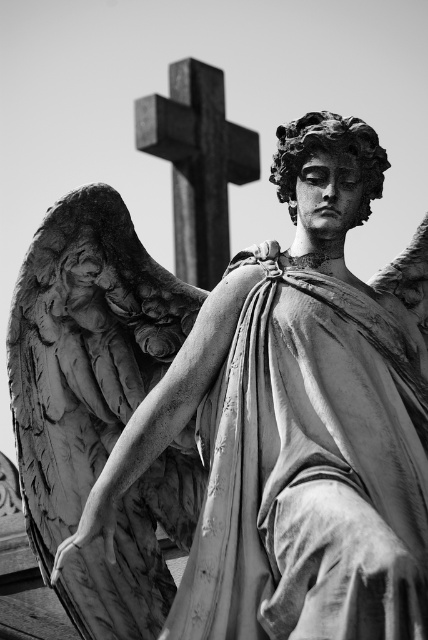
You are a photographer adjusting your camera settings to focus on two specific points in the statue image. The first point is at coordinates point (382, 500) and the second is at point (155, 134). Which point should you focus on first if you want to ensure the closest object is sharp?

Point (382, 500) is closer to the camera than point (155, 134), so you should focus on point (382, 500) first to ensure the closest object is sharp.

Based on the scene described, which object is taller between the smooth stone angel wings at left and the smooth stone cross at upper center?

The smooth stone angel wings at left is taller than the smooth stone cross at upper center according to the description.

Based on the photo, you are an art student analyzing the statue in the image. You notice the smooth stone angel at center and the smooth stone angel wings at left. Which part of the statue is positioned closer to you?

The smooth stone angel at center is closer to the viewer than the smooth stone angel wings at left.